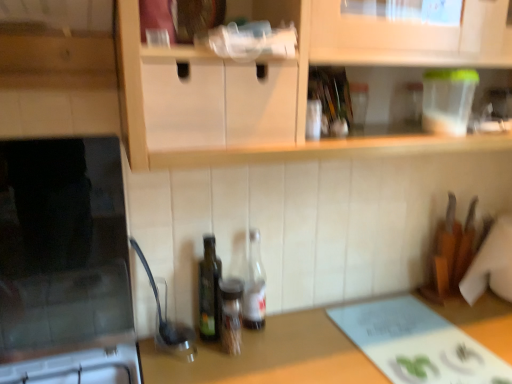
What are the coordinates of `vacant area that is in front of translucent glass bottle at center, the first bottle when ordered from right to left` in the screenshot? It's located at (248, 359).